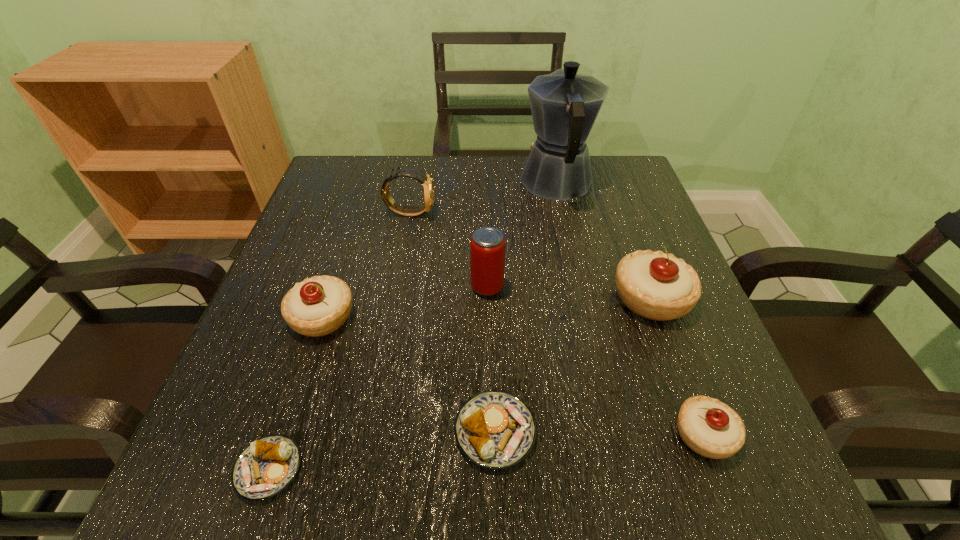
Identify the location of coffeepot present at the far edge. This screenshot has height=540, width=960. (564, 105).

Find the location of a particular element. This screenshot has height=540, width=960. watch positioned at the far edge is located at coordinates (428, 188).

Locate an element on the screen. coffeepot present at the right edge is located at coordinates (564, 105).

The height and width of the screenshot is (540, 960). What are the coordinates of `object present at the near left corner` in the screenshot? It's located at (267, 466).

The image size is (960, 540). I want to click on object that is at the far right corner, so click(564, 105).

Where is `object situated at the near right corner`? Image resolution: width=960 pixels, height=540 pixels. object situated at the near right corner is located at coordinates (709, 427).

At what (x,y) coordinates should I click in order to perform the action: click on free space at the far edge of the desktop. Please return your answer as a coordinate pair (x, y). Image resolution: width=960 pixels, height=540 pixels. Looking at the image, I should click on (472, 171).

The image size is (960, 540). In the image, there is a desktop. Find the location of `vacant area at the left edge`. vacant area at the left edge is located at coordinates (321, 224).

Where is `free region at the right edge of the desktop`? The height and width of the screenshot is (540, 960). free region at the right edge of the desktop is located at coordinates pyautogui.click(x=615, y=295).

I want to click on vacant space at the far left corner of the desktop, so click(x=332, y=173).